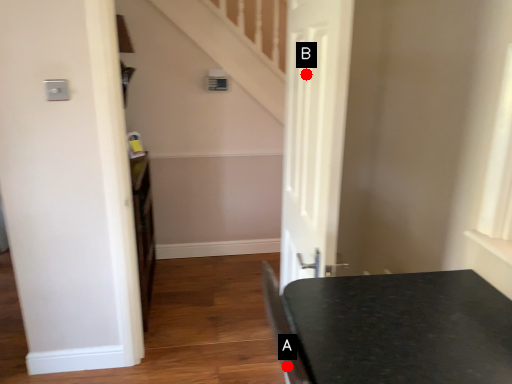
Question: Two points are circled on the image, labeled by A and B beside each circle. Which of the following is the farthest from the observer?

Choices:
 (A) A is further
 (B) B is further

Answer: (B)